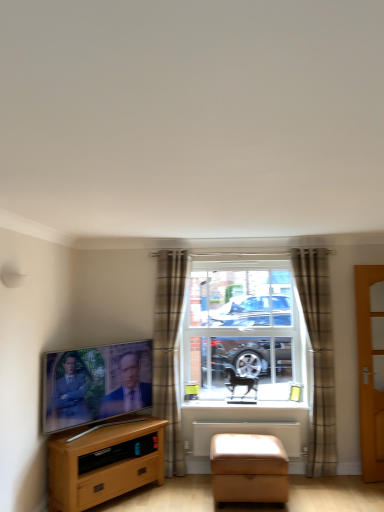
Question: From the image's perspective, is plaid fabric curtain at center, the 1th curtain in the left-to-right sequence, under matte black tv at left?

Choices:
 (A) no
 (B) yes

Answer: (A)

Question: Is plaid fabric curtain at center, the 1th curtain in the left-to-right sequence, to the left of matte black tv at left from the viewer's perspective?

Choices:
 (A) yes
 (B) no

Answer: (B)

Question: Can you confirm if plaid fabric curtain at center, the 1th curtain in the left-to-right sequence, is shorter than matte black tv at left?

Choices:
 (A) no
 (B) yes

Answer: (A)

Question: Can you confirm if plaid fabric curtain at center, the 1th curtain in the left-to-right sequence, is taller than matte black tv at left?

Choices:
 (A) no
 (B) yes

Answer: (B)

Question: Can you see plaid fabric curtain at center, positioned as the 2th curtain in right-to-left order, touching matte black tv at left?

Choices:
 (A) no
 (B) yes

Answer: (A)

Question: From the image's perspective, is clear glass window at center positioned above or below matte black tv at left?

Choices:
 (A) below
 (B) above

Answer: (B)

Question: Which is correct: clear glass window at center is inside matte black tv at left, or outside of it?

Choices:
 (A) inside
 (B) outside

Answer: (B)

Question: Would you say clear glass window at center is to the left or to the right of matte black tv at left in the picture?

Choices:
 (A) left
 (B) right

Answer: (B)

Question: Is point pyautogui.click(x=226, y=265) closer or farther from the camera than point pyautogui.click(x=61, y=360)?

Choices:
 (A) closer
 (B) farther

Answer: (B)

Question: In the image, is brown plaid curtain at center, the 2th curtain when ordered from left to right, positioned in front of or behind plaid fabric curtain at center, the 1th curtain in the left-to-right sequence?

Choices:
 (A) front
 (B) behind

Answer: (A)

Question: Considering the positions of brown plaid curtain at center, the 1th curtain from the right, and plaid fabric curtain at center, positioned as the 2th curtain in right-to-left order, in the image, is brown plaid curtain at center, the 1th curtain from the right, wider or thinner than plaid fabric curtain at center, positioned as the 2th curtain in right-to-left order,?

Choices:
 (A) thin
 (B) wide

Answer: (A)

Question: Does point (326, 311) appear closer or farther from the camera than point (183, 466)?

Choices:
 (A) closer
 (B) farther

Answer: (B)

Question: Is brown plaid curtain at center, the 2th curtain when ordered from left to right, to the left or to the right of plaid fabric curtain at center, positioned as the 2th curtain in right-to-left order, in the image?

Choices:
 (A) left
 (B) right

Answer: (B)

Question: From a real-world perspective, relative to clear glass window at center, is tan leather footrest at lower center vertically above or below?

Choices:
 (A) below
 (B) above

Answer: (A)

Question: Considering the positions of point (256, 468) and point (226, 355), is point (256, 468) closer or farther from the camera than point (226, 355)?

Choices:
 (A) closer
 (B) farther

Answer: (A)